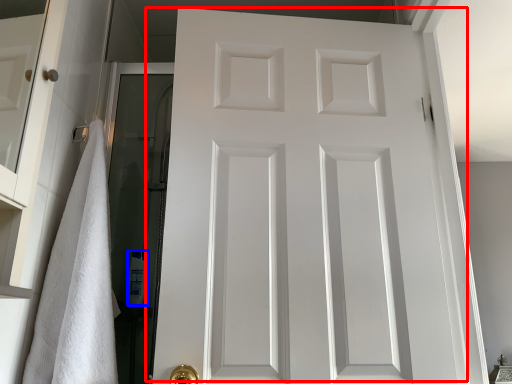
Question: Which object appears closest to the camera in this image, door (highlighted by a red box) or toiletry (highlighted by a blue box)?

Choices:
 (A) door
 (B) toiletry

Answer: (A)